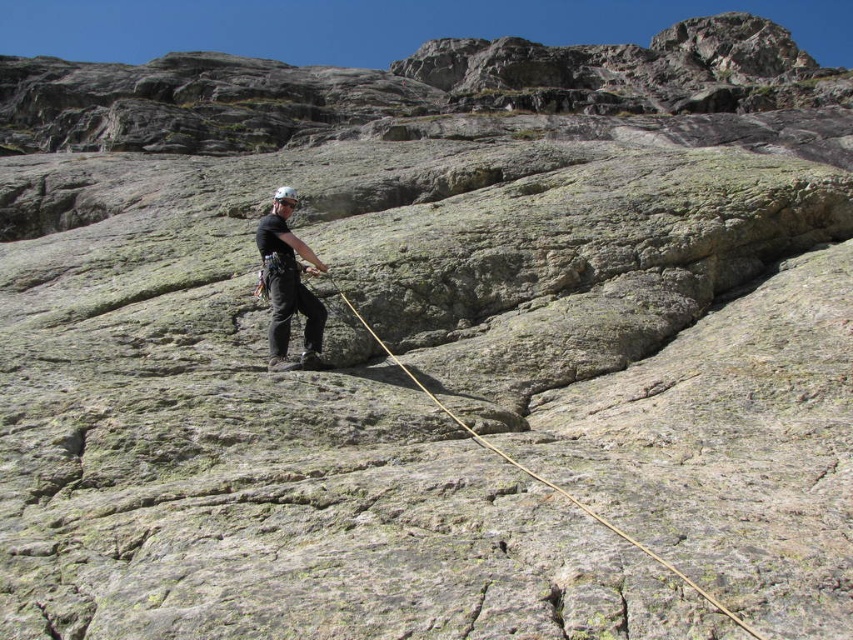
Can you confirm if matte black helmet at center is wider than brown rough rope at center?

In fact, matte black helmet at center might be narrower than brown rough rope at center.

Is matte black helmet at center in front of brown rough rope at center?

No, it is not.

What do you see at coordinates (287, 284) in the screenshot? Image resolution: width=853 pixels, height=640 pixels. I see `matte black helmet at center` at bounding box center [287, 284].

Where is `matte black helmet at center`? This screenshot has width=853, height=640. matte black helmet at center is located at coordinates (287, 284).